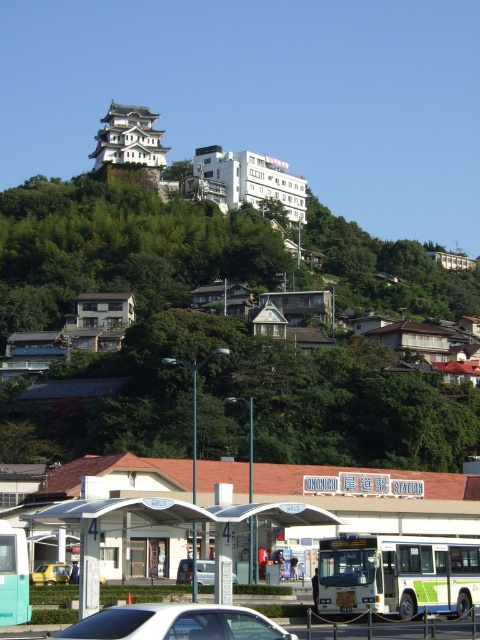
Who is higher up, white matte car at lower center or silver metallic van at center?

Positioned higher is white matte car at lower center.

Is white matte car at lower center positioned in front of silver metallic van at center?

Yes, it is.

Which is in front, point (143, 627) or point (207, 579)?

Point (143, 627)

Image resolution: width=480 pixels, height=640 pixels. I want to click on white matte car at lower center, so click(176, 624).

Is white matte car at lower center to the right of yellow matte taxi at lower left from the viewer's perspective?

Correct, you'll find white matte car at lower center to the right of yellow matte taxi at lower left.

Find the location of a particular element. Image resolution: width=480 pixels, height=640 pixels. white matte car at lower center is located at coordinates (176, 624).

Locate an element on the screen. Image resolution: width=480 pixels, height=640 pixels. white matte car at lower center is located at coordinates [x=176, y=624].

Who is more forward, (349, 568) or (190, 573)?

Point (349, 568) is in front.

Does white metallic bus at lower center have a greater height compared to silver metallic van at center?

In fact, white metallic bus at lower center may be shorter than silver metallic van at center.

Is point (421, 554) behind point (211, 563)?

No, it is not.

The width and height of the screenshot is (480, 640). Find the location of `white metallic bus at lower center`. white metallic bus at lower center is located at coordinates (397, 573).